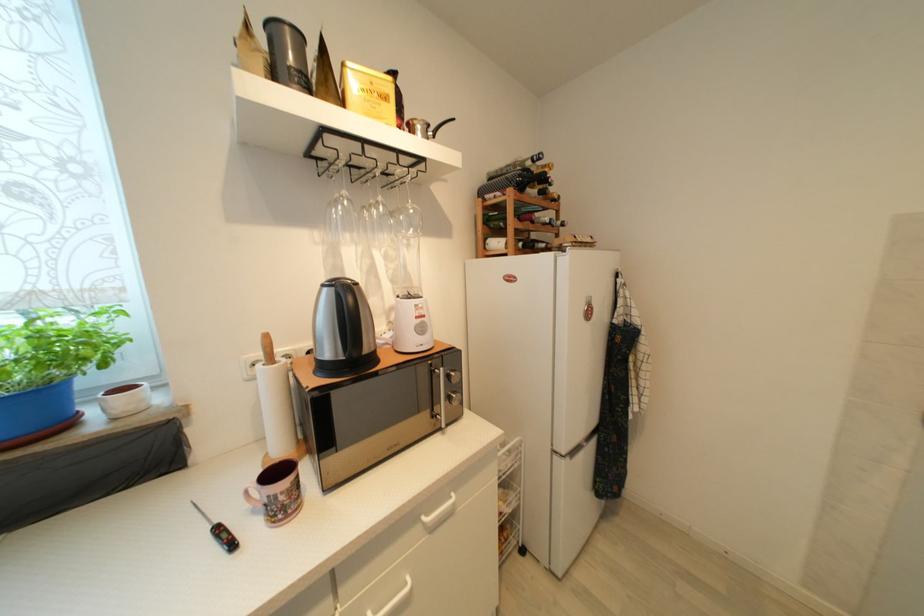
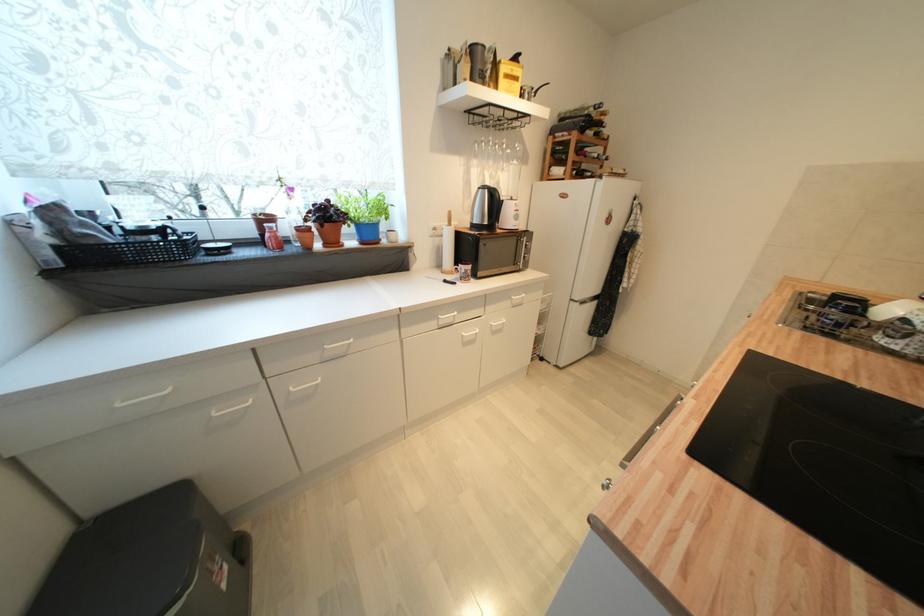
Locate, in the second image, the point that corresponds to point (416, 299) in the first image.

(517, 201)